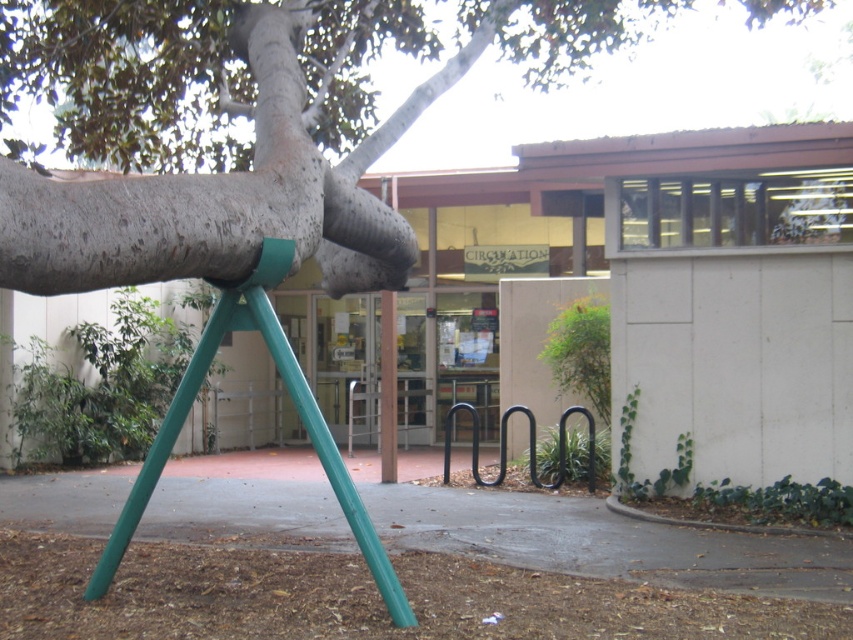
The width and height of the screenshot is (853, 640). Describe the element at coordinates (242, 125) in the screenshot. I see `smooth gray bark at upper center` at that location.

Where is `smooth gray bark at upper center`? smooth gray bark at upper center is located at coordinates (242, 125).